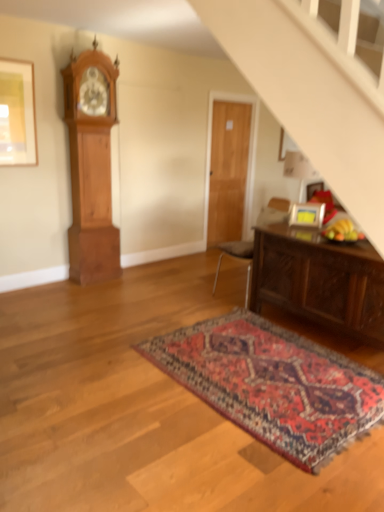
Question: Based on their positions, is matte gold picture frame at upper left, marked as the 2th picture frame in a right-to-left arrangement, located to the left or right of matte gold picture frame at upper right, which ranks as the 2th picture frame in left-to-right order?

Choices:
 (A) right
 (B) left

Answer: (B)

Question: Does point (13, 150) appear closer or farther from the camera than point (314, 226)?

Choices:
 (A) farther
 (B) closer

Answer: (A)

Question: Which of these objects is positioned farthest from the matte gold picture frame at upper left, the second picture frame ordered from the bottom?

Choices:
 (A) matte gold picture frame at upper right, which ranks as the 2th picture frame in left-to-right order
 (B) dark brown wooden table at lower right
 (C) wooden grandfather clock at left
 (D) carpeted rug at center
 (E) wooden door at center

Answer: (D)

Question: Which object is the closest to the brown leather chair at center?

Choices:
 (A) dark brown wooden table at lower right
 (B) matte gold picture frame at upper left, marked as the 2th picture frame in a right-to-left arrangement
 (C) wooden door at center
 (D) wooden grandfather clock at left
 (E) matte gold picture frame at upper right, the first picture frame from the bottom

Answer: (E)